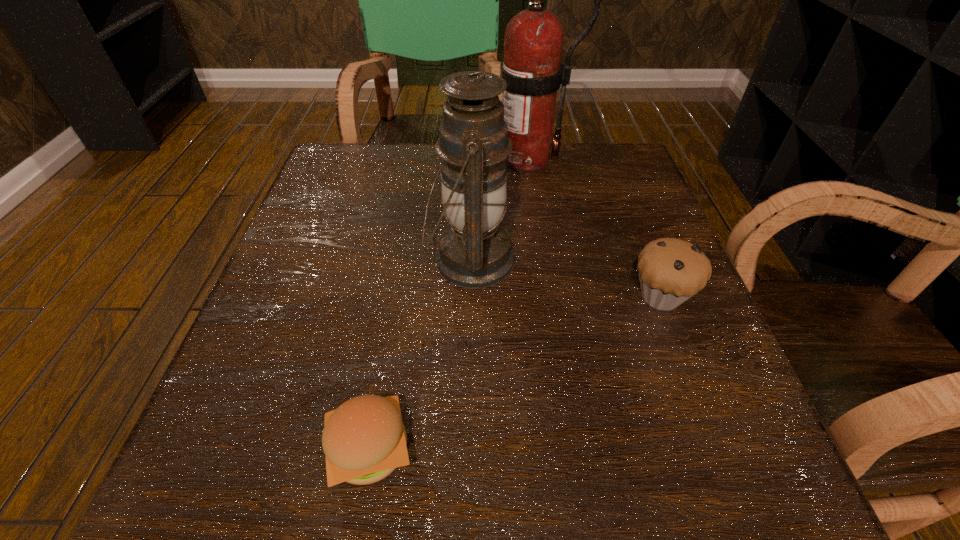
Locate an element on the screen. The width and height of the screenshot is (960, 540). vacant position in the image that satisfies the following two spatial constraints: 1. on the back side of the rightmost object; 2. at the nozzle of the tallest object is located at coordinates (608, 158).

I want to click on vacant space that satisfies the following two spatial constraints: 1. at the nozzle of the fire extinguisher; 2. on the front side of the shortest object, so click(x=564, y=449).

Locate an element on the screen. vacant region that satisfies the following two spatial constraints: 1. at the nozzle of the farthest object; 2. on the front side of the third shortest object is located at coordinates click(x=540, y=260).